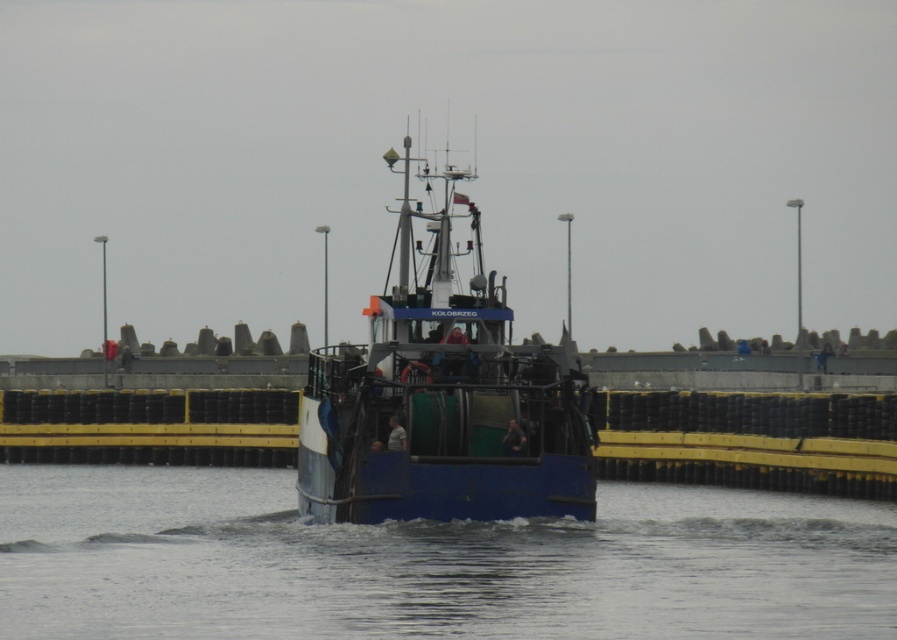
You are a marine biologist on a research vessel and need to collect water samples from the blue water at center near the blue matte boat at center. Given that your sampling equipment has a maximum reach of 7 meters, can you collect the sample without moving your vessel closer?

The distance between the blue water at center and the blue matte boat at center is 7.45 meters, which exceeds the 7 meter reach of the sampling equipment. Therefore, you cannot collect the sample without moving closer.

You are standing on the deck of the fishing boat named Kolobrzeg and want to know the exact coordinates of the blue water at center. What are the coordinates?

The blue water at center is located at point (429,563).